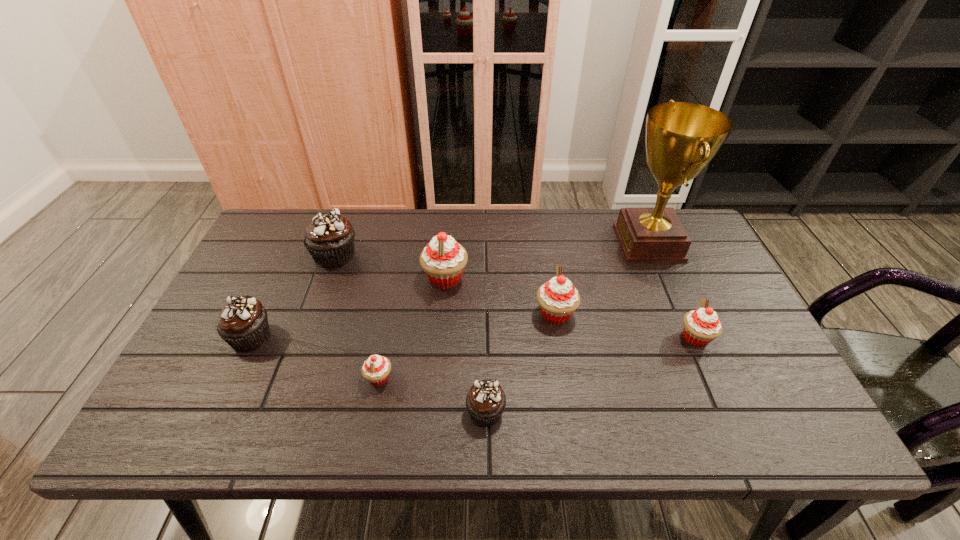
Locate which cupcake ranks in proximity to the farthest pink cupcake. Please provide its 2D coordinates. Your answer should be formatted as a tuple, i.e. [(x, y)], where the tuple contains the x and y coordinates of a point satisfying the conditions above.

[(558, 298)]

Locate which cupcake is the second closest to the sixth object from right to left. Please provide its 2D coordinates. Your answer should be formatted as a tuple, i.e. [(x, y)], where the tuple contains the x and y coordinates of a point satisfying the conditions above.

[(443, 260)]

Select which pink cupcake appears as the fourth closest to the second nearest brown cupcake. Please provide its 2D coordinates. Your answer should be formatted as a tuple, i.e. [(x, y)], where the tuple contains the x and y coordinates of a point satisfying the conditions above.

[(701, 326)]

Select which pink cupcake appears as the fourth closest to the second nearest brown cupcake. Please provide its 2D coordinates. Your answer should be formatted as a tuple, i.e. [(x, y)], where the tuple contains the x and y coordinates of a point satisfying the conditions above.

[(701, 326)]

Select which brown cupcake appears as the second closest to the third pink cupcake from right to left. Please provide its 2D coordinates. Your answer should be formatted as a tuple, i.e. [(x, y)], where the tuple contains the x and y coordinates of a point satisfying the conditions above.

[(485, 402)]

Select which brown cupcake appears as the second closest to the biggest brown cupcake. Please provide its 2D coordinates. Your answer should be formatted as a tuple, i.e. [(x, y)], where the tuple contains the x and y coordinates of a point satisfying the conditions above.

[(485, 402)]

Where is `vacant area that satisfies the following two spatial constraints: 1. on the back side of the second biggest pink cupcake; 2. on the left side of the second nearest object`? vacant area that satisfies the following two spatial constraints: 1. on the back side of the second biggest pink cupcake; 2. on the left side of the second nearest object is located at coordinates tap(392, 314).

Find the location of a particular element. This screenshot has height=540, width=960. vacant space that satisfies the following two spatial constraints: 1. on the front side of the second brown cupcake from right to left; 2. on the left side of the nearest cupcake is located at coordinates (278, 411).